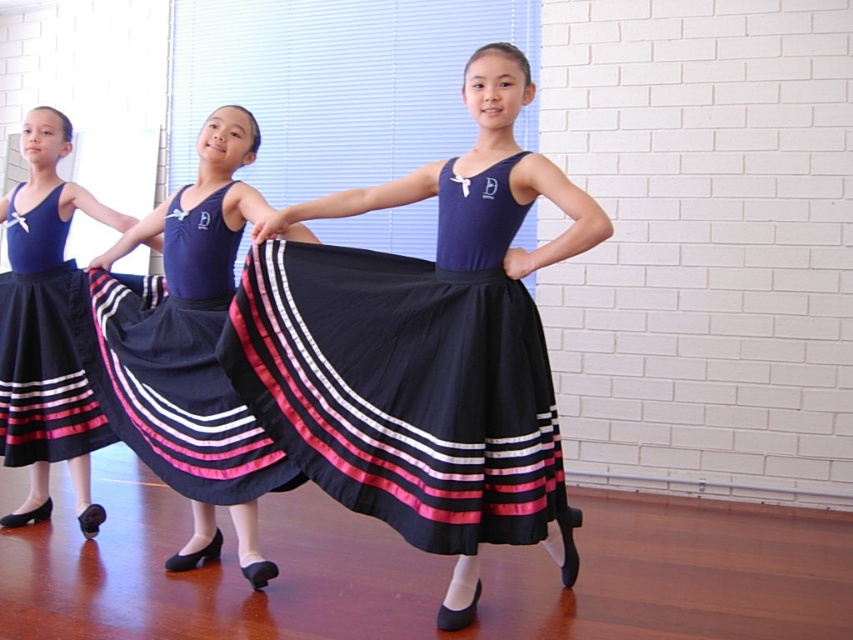
Question: Which of the following is the closest to the observer?

Choices:
 (A) (428, 275)
 (B) (44, 368)

Answer: (A)

Question: Is black satin skirt at center closer to the viewer compared to matte black skirt at center?

Choices:
 (A) yes
 (B) no

Answer: (A)

Question: Can you confirm if black satin skirt at center is thinner than navy satin skirt at center?

Choices:
 (A) no
 (B) yes

Answer: (A)

Question: Does black satin skirt at center lie behind matte black skirt at left?

Choices:
 (A) yes
 (B) no

Answer: (B)

Question: Which point is closer to the camera taking this photo?

Choices:
 (A) (456, 305)
 (B) (18, 371)
 (C) (38, 436)
 (D) (183, 305)

Answer: (A)

Question: Which point is closer to the camera taking this photo?

Choices:
 (A) (25, 458)
 (B) (233, 502)

Answer: (B)